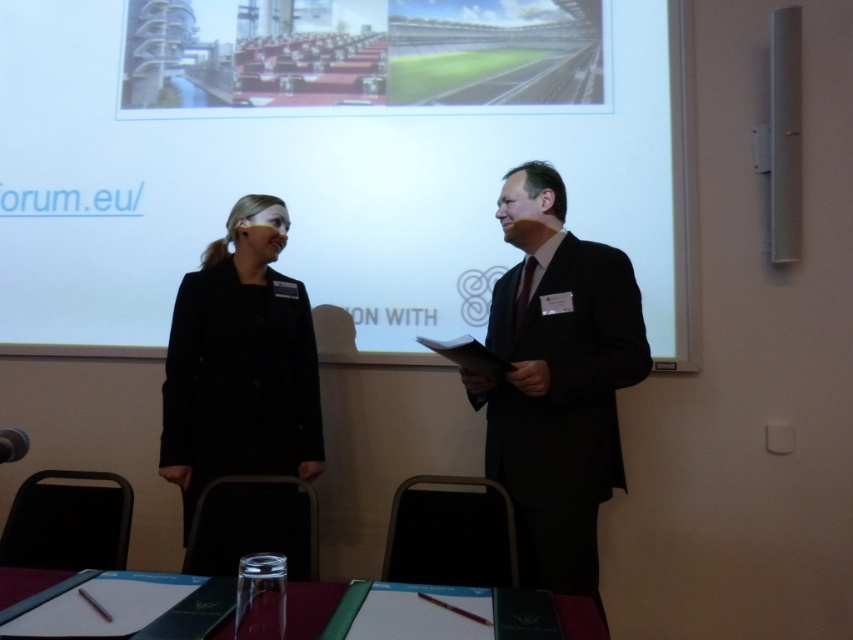
Measure the distance from black suit at center to black matte coat at center.

black suit at center and black matte coat at center are 30.33 inches apart from each other.

Does point (548, 218) lie in front of point (177, 326)?

Yes, point (548, 218) is closer to viewer.

I want to click on black suit at center, so click(556, 380).

Does white matte projection screen at upper center have a greater width compared to black suit at center?

Yes.

Can you confirm if white matte projection screen at upper center is positioned to the left of black suit at center?

Indeed, white matte projection screen at upper center is positioned on the left side of black suit at center.

Is point (498, 156) positioned in front of point (595, 353)?

No, it is behind (595, 353).

Where is `white matte projection screen at upper center`? The width and height of the screenshot is (853, 640). white matte projection screen at upper center is located at coordinates (x=329, y=154).

Consider the image. Is white matte projection screen at upper center positioned before black matte coat at center?

No, it is not.

You are a GUI agent. You are given a task and a screenshot of the screen. Output one action in this format:
    pyautogui.click(x=<x>, y=<y>)
    Task: Click on the white matte projection screen at upper center
    
    Given the screenshot: What is the action you would take?
    pyautogui.click(x=329, y=154)

The height and width of the screenshot is (640, 853). Identify the location of white matte projection screen at upper center. (329, 154).